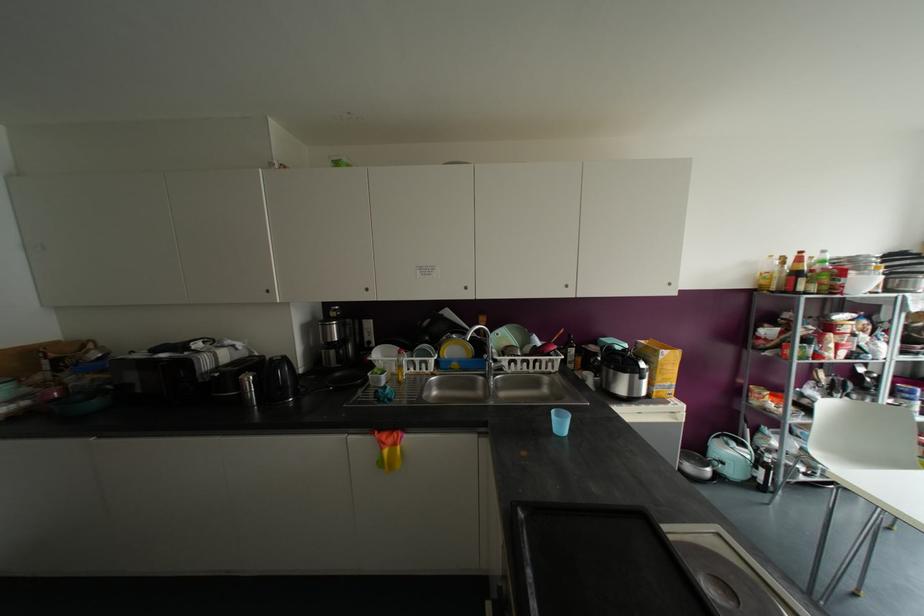
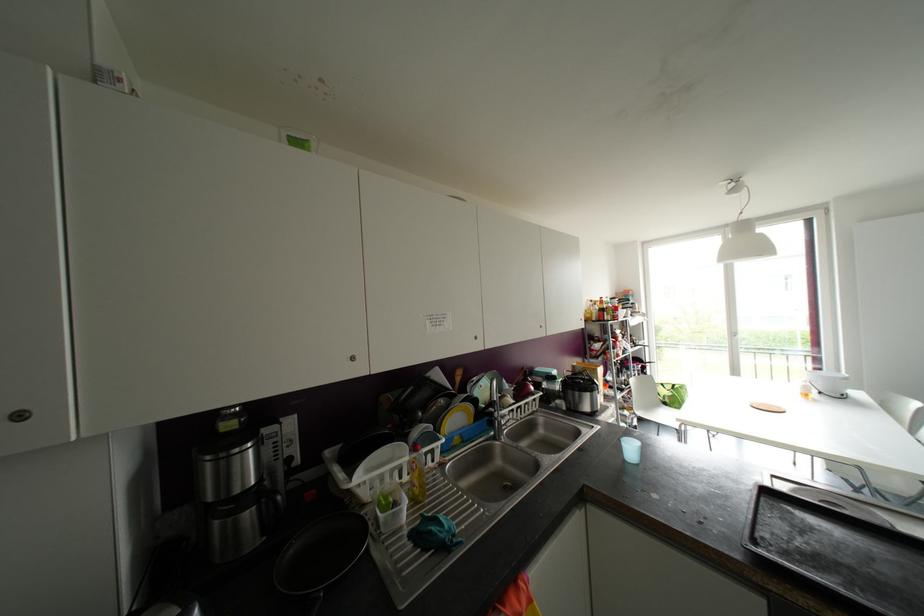
In the second image, find the point that corresponds to the point at 367,289 in the first image.

(351, 358)